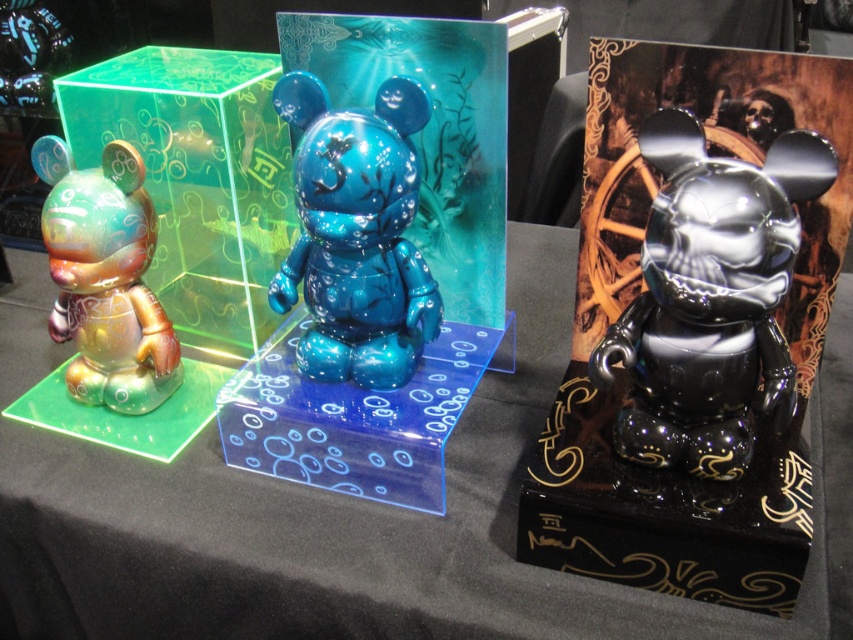
You are arranging these figurines on a shelf and want to place the shiny black bear at right and the translucent blue acrylic at center in a way that follows their current spatial relationship. Which object should be placed higher up?

The shiny black bear at right should be placed higher up because it is located above the translucent blue acrylic at center in the original arrangement.

You are an interior designer arranging these figurines on a shelf. You want to ensure that the shiny black bear at right and the translucent blue acrylic at center are visible from the front. Which figurine should you place closer to the front to avoid blocking the view of the other?

The translucent blue acrylic at center is shorter than the shiny black bear at right, so place the translucent blue acrylic at center closer to the front to prevent it from being blocked by the taller shiny black bear at right.